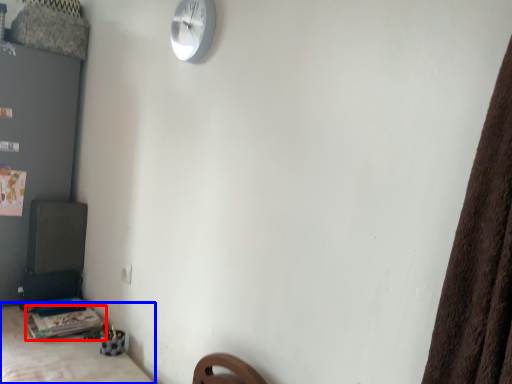
Question: Among these objects, which one is farthest to the camera, table (highlighted by a red box) or furniture (highlighted by a blue box)?

Choices:
 (A) table
 (B) furniture

Answer: (A)